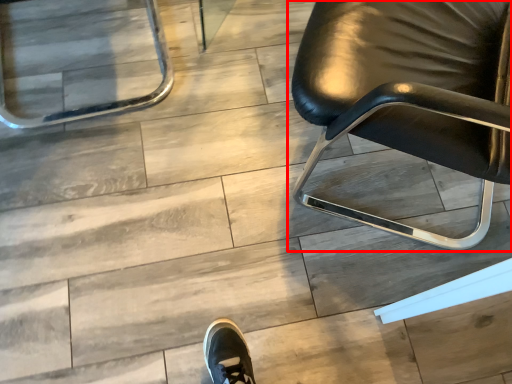
Question: Observing the image, what is the correct spatial positioning of chair (annotated by the red box) in reference to chair?

Choices:
 (A) left
 (B) right

Answer: (B)